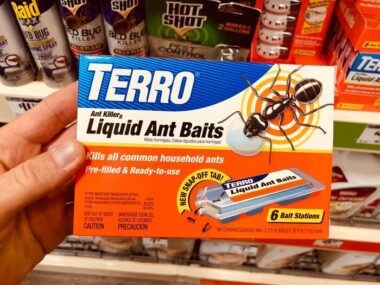
Image resolution: width=380 pixels, height=285 pixels. In order to click on white shelf in this screenshot , I will do pyautogui.click(x=37, y=88).